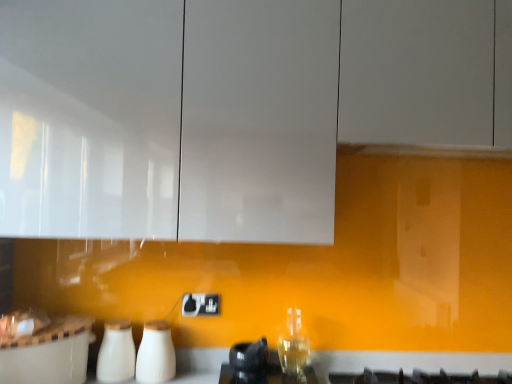
Where is `empty space that is ontop of white glossy countertop at lower center`? empty space that is ontop of white glossy countertop at lower center is located at coordinates (326, 346).